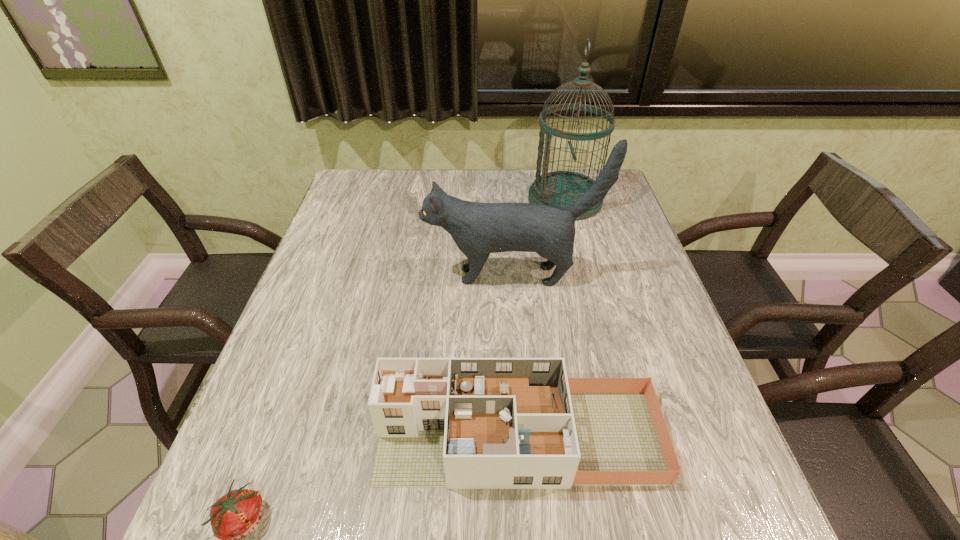
Where is `free space located at the face of the cat`? The height and width of the screenshot is (540, 960). free space located at the face of the cat is located at coordinates (337, 275).

Image resolution: width=960 pixels, height=540 pixels. Identify the location of vacant area situated at the face of the cat. (391, 275).

I want to click on free region located at the front door of the third farthest object, so click(x=324, y=437).

Where is `vacant area situated at the front door of the third farthest object`? vacant area situated at the front door of the third farthest object is located at coordinates (265, 437).

The image size is (960, 540). In order to click on vacant space located at the front door of the third farthest object in this screenshot , I will do `click(287, 437)`.

What are the coordinates of `object located at the far edge` in the screenshot? It's located at (562, 188).

Locate an element on the screen. birdcage located in the right edge section of the desktop is located at coordinates (562, 188).

What are the coordinates of `cat present at the right edge` in the screenshot? It's located at (478, 229).

You are a GUI agent. You are given a task and a screenshot of the screen. Output one action in this format:
    pyautogui.click(x=<x>, y=<y>)
    Task: Click on the dollhouse present at the right edge
    
    Given the screenshot: What is the action you would take?
    pyautogui.click(x=459, y=423)

At what (x,y) coordinates should I click in order to perform the action: click on object at the far right corner. Please return your answer as a coordinate pair (x, y). The image size is (960, 540). Looking at the image, I should click on (562, 188).